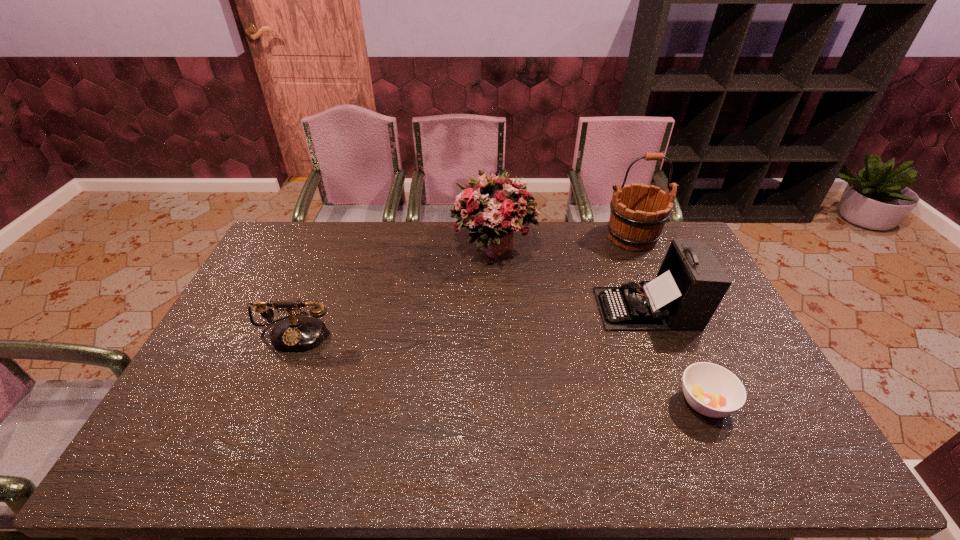
Image resolution: width=960 pixels, height=540 pixels. Identify the location of soup bowl that is at the right edge. (712, 390).

Locate an element on the screen. object at the far right corner is located at coordinates click(x=638, y=214).

Where is `vacant space at the far edge of the desktop`? vacant space at the far edge of the desktop is located at coordinates (335, 228).

In the image, there is a desktop. Identify the location of free space at the near edge. Image resolution: width=960 pixels, height=540 pixels. (697, 466).

In the image, there is a desktop. Identify the location of vacant space at the left edge. The image size is (960, 540). (202, 405).

At what (x,y) coordinates should I click in order to perform the action: click on vacant area that lies between the second shortest object and the nearest object. Please return your answer as a coordinate pair (x, y). Image resolution: width=960 pixels, height=540 pixels. Looking at the image, I should click on (501, 367).

The width and height of the screenshot is (960, 540). I want to click on empty space between the shortest object and the second tallest object, so click(x=599, y=325).

Where is `free space between the fourth object from right to left and the shortest object`? This screenshot has width=960, height=540. free space between the fourth object from right to left and the shortest object is located at coordinates (599, 325).

Locate an element on the screen. The width and height of the screenshot is (960, 540). free point between the shortest object and the typewriter is located at coordinates (676, 355).

In order to click on free point between the wine bucket and the bouquet in this screenshot , I will do `click(563, 242)`.